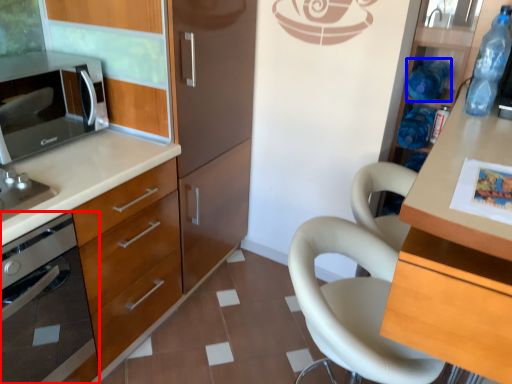
Question: Which object appears farthest to the camera in this image, home appliance (highlighted by a red box) or bottle (highlighted by a blue box)?

Choices:
 (A) home appliance
 (B) bottle

Answer: (B)